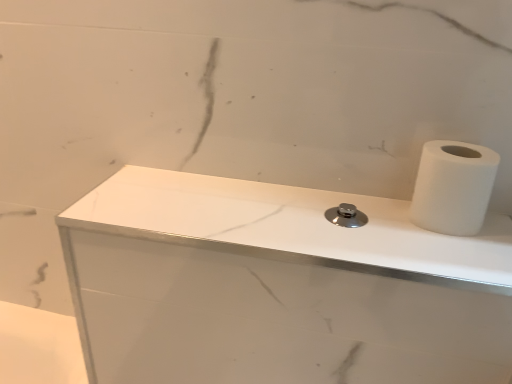
This screenshot has width=512, height=384. In order to click on white matte paper towel at right in this screenshot , I will do `click(453, 187)`.

This screenshot has width=512, height=384. Describe the element at coordinates (453, 187) in the screenshot. I see `white matte paper towel at right` at that location.

Describe the element at coordinates (279, 286) in the screenshot. I see `white marble counter top at center` at that location.

Measure the distance between white marble counter top at center and camera.

The distance of white marble counter top at center from camera is 49.01 centimeters.

Identify the location of white marble counter top at center. (279, 286).

The height and width of the screenshot is (384, 512). I want to click on white matte paper towel at right, so click(x=453, y=187).

Considering the relative positions of white matte paper towel at right and white marble counter top at center in the image provided, is white matte paper towel at right to the left or to the right of white marble counter top at center?

From the image, it's evident that white matte paper towel at right is to the right of white marble counter top at center.

Is the depth of white matte paper towel at right less than that of white marble counter top at center?

No, white matte paper towel at right is behind white marble counter top at center.

Is point (476, 213) positioned in front of point (146, 243)?

No, (476, 213) is further to viewer.

From the image's perspective, who appears lower, white matte paper towel at right or white marble counter top at center?

white marble counter top at center, from the image's perspective.

From a real-world perspective, is white matte paper towel at right positioned under white marble counter top at center based on gravity?

Incorrect, from a real-world perspective, white matte paper towel at right is higher than white marble counter top at center.

Considering the relative sizes of white matte paper towel at right and white marble counter top at center in the image provided, is white matte paper towel at right thinner than white marble counter top at center?

Correct, the width of white matte paper towel at right is less than that of white marble counter top at center.

Who is taller, white matte paper towel at right or white marble counter top at center?

white marble counter top at center.

Which of these two, white matte paper towel at right or white marble counter top at center, is smaller?

white matte paper towel at right.

Would you say white matte paper towel at right is inside or outside white marble counter top at center?

white matte paper towel at right exists outside the volume of white marble counter top at center.

Is the surface of white matte paper towel at right in direct contact with white marble counter top at center?

They are not placed beside each other.

Is white marble counter top at center at the back of white matte paper towel at right?

white matte paper towel at right does not have its back to white marble counter top at center.

Based on the photo, how different are the orientations of white matte paper towel at right and white marble counter top at center in degrees?

white matte paper towel at right and white marble counter top at center are facing 0.294 degrees away from each other.

Where is `counter top in front of the white matte paper towel at right`? This screenshot has width=512, height=384. counter top in front of the white matte paper towel at right is located at coordinates (279, 286).

Based on their positions, is white marble counter top at center located to the left or right of white matte paper towel at right?

From the image, it's evident that white marble counter top at center is to the left of white matte paper towel at right.

Is white marble counter top at center positioned in front of white matte paper towel at right?

Yes, it is.

Considering the positions of point (218, 305) and point (465, 183), is point (218, 305) closer or farther from the camera than point (465, 183)?

Point (218, 305) is farther from the camera than point (465, 183).

From the image's perspective, which is above, white marble counter top at center or white matte paper towel at right?

From the image's view, white matte paper towel at right is above.

From a real-world perspective, which object stands above the other?

white matte paper towel at right is physically above.

Considering the sizes of white marble counter top at center and white matte paper towel at right in the image, is white marble counter top at center wider or thinner than white matte paper towel at right?

Clearly, white marble counter top at center has more width compared to white matte paper towel at right.

Looking at this image, between white marble counter top at center and white matte paper towel at right, which one has less height?

white matte paper towel at right.

Who is bigger, white marble counter top at center or white matte paper towel at right?

white marble counter top at center is bigger.

Is white matte paper towel at right completely or partially inside white marble counter top at center?

Definitely not — white matte paper towel at right is not inside white marble counter top at center.

Is white marble counter top at center in contact with white matte paper towel at right?

white marble counter top at center and white matte paper towel at right are not in contact.

Is white marble counter top at center facing towards white matte paper towel at right?

No, white marble counter top at center is not oriented towards white matte paper towel at right.

Can you tell me how much white marble counter top at center and white matte paper towel at right differ in facing direction?

white marble counter top at center and white matte paper towel at right are facing 0.294 degrees away from each other.

Locate an element on the screen. The width and height of the screenshot is (512, 384). counter top below the white matte paper towel at right (from the image's perspective) is located at coordinates (279, 286).

I want to click on counter top on the left of the white matte paper towel at right, so click(279, 286).

Image resolution: width=512 pixels, height=384 pixels. Find the location of `counter top below the white matte paper towel at right (from a real-world perspective)`. counter top below the white matte paper towel at right (from a real-world perspective) is located at coordinates (279, 286).